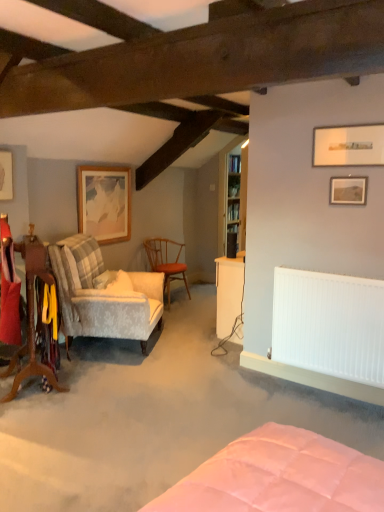
Question: From a real-world perspective, is matte white picture frame at upper right, the first picture frame when ordered from front to back, positioned over white soft pillow at left based on gravity?

Choices:
 (A) no
 (B) yes

Answer: (B)

Question: Considering the relative sizes of matte white picture frame at upper right, the third picture frame in the left-to-right sequence, and white soft pillow at left in the image provided, is matte white picture frame at upper right, the third picture frame in the left-to-right sequence, bigger than white soft pillow at left?

Choices:
 (A) yes
 (B) no

Answer: (B)

Question: Is matte white picture frame at upper right, the first picture frame when ordered from front to back, to the left of white soft pillow at left from the viewer's perspective?

Choices:
 (A) yes
 (B) no

Answer: (B)

Question: Is matte white picture frame at upper right, which is the 2th picture frame from right to left, closer to camera compared to white soft pillow at left?

Choices:
 (A) yes
 (B) no

Answer: (A)

Question: Is white soft pillow at left inside matte white picture frame at upper right, which is the 2th picture frame from right to left?

Choices:
 (A) no
 (B) yes

Answer: (A)

Question: Is wooden framed artwork at upper left, the third picture frame when ordered from right to left, inside the boundaries of wooden textured chair at center, arranged as the first chair when viewed from the back, or outside?

Choices:
 (A) inside
 (B) outside

Answer: (B)

Question: Relative to wooden textured chair at center, arranged as the first chair when viewed from the back, is wooden framed artwork at upper left, which ranks as the second picture frame in left-to-right order, in front or behind?

Choices:
 (A) behind
 (B) front

Answer: (B)

Question: Based on their positions, is wooden framed artwork at upper left, which ranks as the second picture frame in left-to-right order, located to the left or right of wooden textured chair at center, positioned as the 3th chair in front-to-back order?

Choices:
 (A) left
 (B) right

Answer: (A)

Question: From a real-world perspective, is wooden framed artwork at upper left, which ranks as the 1th picture frame in back-to-front order, positioned above or below wooden textured chair at center, positioned as the 3th chair in front-to-back order?

Choices:
 (A) above
 (B) below

Answer: (A)

Question: Looking at their shapes, would you say matte wooden picture frame at upper right, which appears as the 1th picture frame when viewed from the right, is wider or thinner than wooden bookshelf at upper center?

Choices:
 (A) wide
 (B) thin

Answer: (B)

Question: From a real-world perspective, relative to wooden bookshelf at upper center, is matte wooden picture frame at upper right, which appears as the 1th picture frame when viewed from the right, vertically above or below?

Choices:
 (A) above
 (B) below

Answer: (B)

Question: Is matte wooden picture frame at upper right, marked as the 2th picture frame in a front-to-back arrangement, bigger or smaller than wooden bookshelf at upper center?

Choices:
 (A) big
 (B) small

Answer: (B)

Question: From the image's perspective, is matte wooden picture frame at upper right, which ranks as the 4th picture frame in left-to-right order, above or below wooden bookshelf at upper center?

Choices:
 (A) above
 (B) below

Answer: (B)

Question: In the image, is matte white picture frame at upper right, which is counted as the fourth picture frame, starting from the back, positioned in front of or behind wooden plaid chair at left, which appears as the third chair when viewed from the back?

Choices:
 (A) behind
 (B) front

Answer: (A)

Question: Is matte white picture frame at upper right, the first picture frame when ordered from front to back, taller or shorter than wooden plaid chair at left, marked as the first chair in a front-to-back arrangement?

Choices:
 (A) tall
 (B) short

Answer: (B)